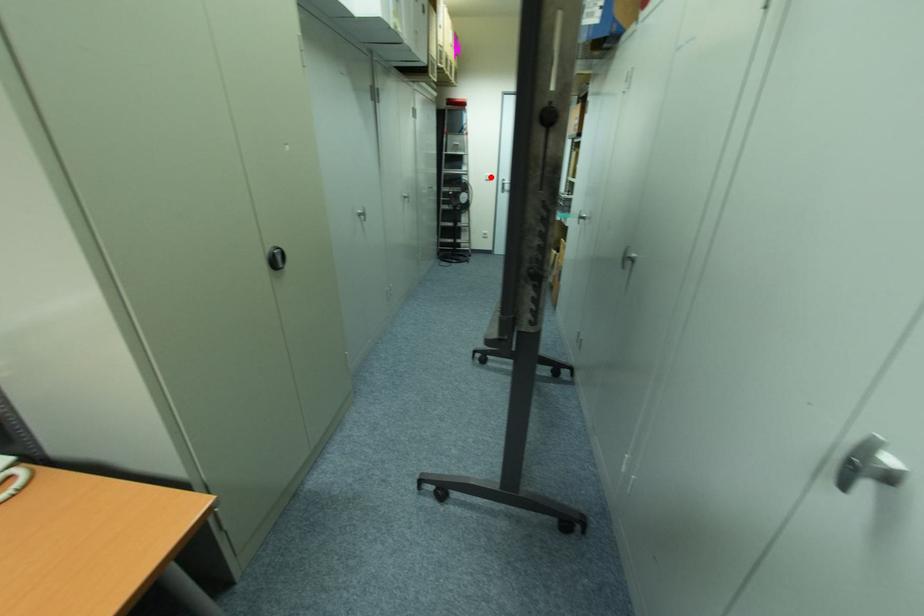
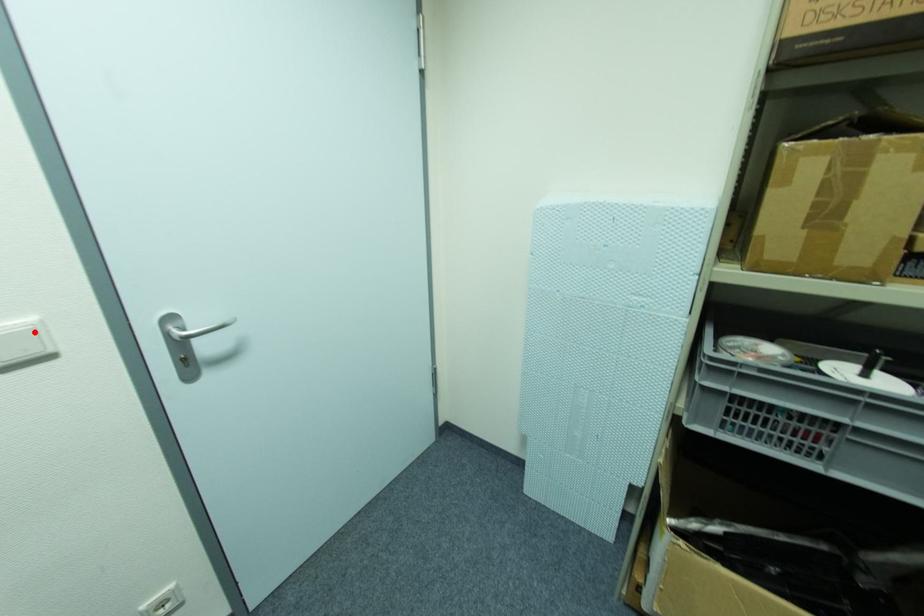
I am providing you with two images of the same scene from different viewpoints. A red point is marked on the first image and another point is marked on the second image. Are the points marked in image1 and image2 representing the same 3D position?

Yes